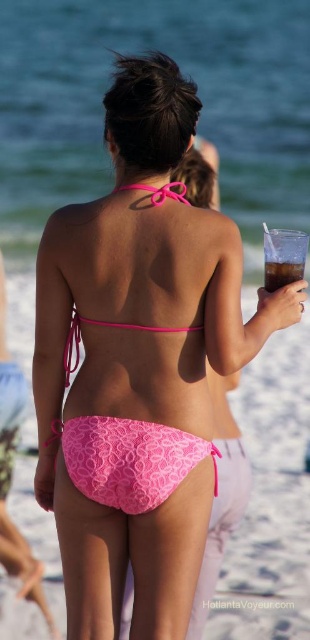
You are a photographer at the beach and want to capture the pink lace bikini at center and the pink lace bikini top at upper center in a single frame. Which object should you focus on first to ensure both are in the frame?

The pink lace bikini at center is larger in size than the pink lace bikini top at upper center, so you should focus on the pink lace bikini at center first to ensure both are in the frame.

You are a photographer taking a picture of the beach scene. You notice the translucent plastic cup at upper right and the pink lace bikini top at upper center in your frame. Which object appears shorter in the photo?

The translucent plastic cup at upper right appears shorter than the pink lace bikini top at upper center because it has a lesser height.

You are a photographer taking a picture of the pink lace bikini at center. The camera is set to focus at point (129, 460). Will the pink lace bikini at center be in focus?

The pink lace bikini at center is located at point (129, 460), so yes, the camera will focus on the pink lace bikini at center.